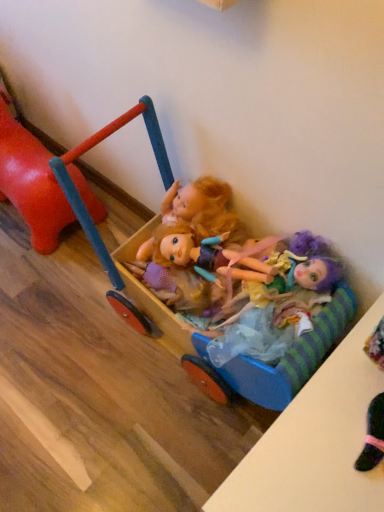
What do you see at coordinates (297, 358) in the screenshot?
I see `wooden cart at center, which is the second toy from left to right` at bounding box center [297, 358].

What do you see at coordinates (31, 183) in the screenshot? I see `rubberized red horse at left, the first toy viewed from the left` at bounding box center [31, 183].

Where is `wooden cart at center, which is the second toy from left to right`? The image size is (384, 512). wooden cart at center, which is the second toy from left to right is located at coordinates (297, 358).

Does multicolored fabric doll at center have a larger size compared to wooden cart at center, which is the first toy from right to left?

Actually, multicolored fabric doll at center might be smaller than wooden cart at center, which is the first toy from right to left.

Is multicolored fabric doll at center taller than wooden cart at center, which is the second toy from left to right?

No, multicolored fabric doll at center is not taller than wooden cart at center, which is the second toy from left to right.

Would you say multicolored fabric doll at center is outside wooden cart at center, which is the first toy from right to left?

No, most part of multicolored fabric doll at center lies within wooden cart at center, which is the first toy from right to left.

Can you tell me how much multicolored fabric doll at center and wooden cart at center, which is the first toy from right to left, differ in facing direction?

They differ by 117 degrees in their facing directions.

Identify the location of doll above the rubberized red horse at left, the 2th toy when ordered from right to left (from a real-world perspective). (278, 303).

Is rubberized red horse at left, the first toy viewed from the left, wider than multicolored fabric doll at center?

Yes, rubberized red horse at left, the first toy viewed from the left, is wider than multicolored fabric doll at center.

How much distance is there between rubberized red horse at left, the first toy viewed from the left, and multicolored fabric doll at center?

rubberized red horse at left, the first toy viewed from the left, is 25.47 inches away from multicolored fabric doll at center.

Which of these two, rubberized red horse at left, the 2th toy when ordered from right to left, or multicolored fabric doll at center, stands taller?

Standing taller between the two is rubberized red horse at left, the 2th toy when ordered from right to left.

Are wooden cart at center, which is the first toy from right to left, and multicolored fabric doll at center making contact?

wooden cart at center, which is the first toy from right to left, and multicolored fabric doll at center are not in contact.

What's the angular difference between wooden cart at center, which is the first toy from right to left, and multicolored fabric doll at center's facing directions?

117 degrees separate the facing orientations of wooden cart at center, which is the first toy from right to left, and multicolored fabric doll at center.

Is wooden cart at center, which is the first toy from right to left, facing away from multicolored fabric doll at center?

Yes, wooden cart at center, which is the first toy from right to left, is facing away from multicolored fabric doll at center.

The height and width of the screenshot is (512, 384). Find the location of `toy in front of the multicolored fabric doll at center`. toy in front of the multicolored fabric doll at center is located at coordinates (297, 358).

Does point (274, 337) appear closer or farther from the camera than point (35, 243)?

Point (274, 337) is closer to the camera than point (35, 243).

From their relative heights in the image, would you say multicolored fabric doll at center is taller or shorter than rubberized red horse at left, the first toy viewed from the left?

multicolored fabric doll at center is shorter than rubberized red horse at left, the first toy viewed from the left.

Which object is further away from the camera, multicolored fabric doll at center or rubberized red horse at left, the 2th toy when ordered from right to left?

Positioned behind is rubberized red horse at left, the 2th toy when ordered from right to left.

From the picture: Is rubberized red horse at left, the 2th toy when ordered from right to left, oriented towards wooden cart at center, which is the second toy from left to right?

No, rubberized red horse at left, the 2th toy when ordered from right to left, is not oriented towards wooden cart at center, which is the second toy from left to right.

Considering the relative positions of rubberized red horse at left, the first toy viewed from the left, and wooden cart at center, which is the second toy from left to right, in the image provided, is rubberized red horse at left, the first toy viewed from the left, to the right of wooden cart at center, which is the second toy from left to right, from the viewer's perspective?

No.

Are rubberized red horse at left, the 2th toy when ordered from right to left, and wooden cart at center, which is the second toy from left to right, far apart?

Actually, rubberized red horse at left, the 2th toy when ordered from right to left, and wooden cart at center, which is the second toy from left to right, are a little close together.

How different are the orientations of rubberized red horse at left, the 2th toy when ordered from right to left, and wooden cart at center, which is the second toy from left to right, in degrees?

The angle between the facing direction of rubberized red horse at left, the 2th toy when ordered from right to left, and the facing direction of wooden cart at center, which is the second toy from left to right, is 0.000281 degrees.

Are wooden cart at center, which is the second toy from left to right, and rubberized red horse at left, the first toy viewed from the left, making contact?

There is a gap between wooden cart at center, which is the second toy from left to right, and rubberized red horse at left, the first toy viewed from the left.

From the image's perspective, is wooden cart at center, which is the second toy from left to right, above or below rubberized red horse at left, the 2th toy when ordered from right to left?

wooden cart at center, which is the second toy from left to right, is situated lower than rubberized red horse at left, the 2th toy when ordered from right to left, in the image.

Is wooden cart at center, which is the second toy from left to right, in front of rubberized red horse at left, the 2th toy when ordered from right to left?

That is True.

Which point is more distant from viewer, (347,318) or (28,209)?

Positioned behind is point (28,209).

In order to click on toy that is the 1st one when counting upward from the multicolored fabric doll at center (from the image's perspective) in this screenshot , I will do `click(297, 358)`.

This screenshot has height=512, width=384. I want to click on the 2nd toy counting from the left side of the multicolored fabric doll at center, so click(x=31, y=183).

From the picture: Considering their positions, is multicolored fabric doll at center positioned further to wooden cart at center, which is the second toy from left to right, than rubberized red horse at left, the first toy viewed from the left?

rubberized red horse at left, the first toy viewed from the left, lies further to wooden cart at center, which is the second toy from left to right, than the other object.

When comparing their distances from rubberized red horse at left, the first toy viewed from the left, does multicolored fabric doll at center or wooden cart at center, which is the first toy from right to left, seem further?

multicolored fabric doll at center.

Estimate the real-world distances between objects in this image. Which object is further from wooden cart at center, which is the first toy from right to left, rubberized red horse at left, the first toy viewed from the left, or multicolored fabric doll at center?

rubberized red horse at left, the first toy viewed from the left, is positioned further to the anchor wooden cart at center, which is the first toy from right to left.

From the image, which object appears to be nearer to multicolored fabric doll at center, wooden cart at center, which is the second toy from left to right, or rubberized red horse at left, the 2th toy when ordered from right to left?

Among the two, wooden cart at center, which is the second toy from left to right, is located nearer to multicolored fabric doll at center.

Considering their positions, is wooden cart at center, which is the first toy from right to left, positioned closer to rubberized red horse at left, the 2th toy when ordered from right to left, than multicolored fabric doll at center?

wooden cart at center, which is the first toy from right to left.

Based on their spatial positions, is rubberized red horse at left, the first toy viewed from the left, or wooden cart at center, which is the first toy from right to left, further from multicolored fabric doll at center?

rubberized red horse at left, the first toy viewed from the left, is further to multicolored fabric doll at center.

Where is `toy between rubberized red horse at left, the first toy viewed from the left, and multicolored fabric doll at center from left to right`? This screenshot has height=512, width=384. toy between rubberized red horse at left, the first toy viewed from the left, and multicolored fabric doll at center from left to right is located at coordinates (297, 358).